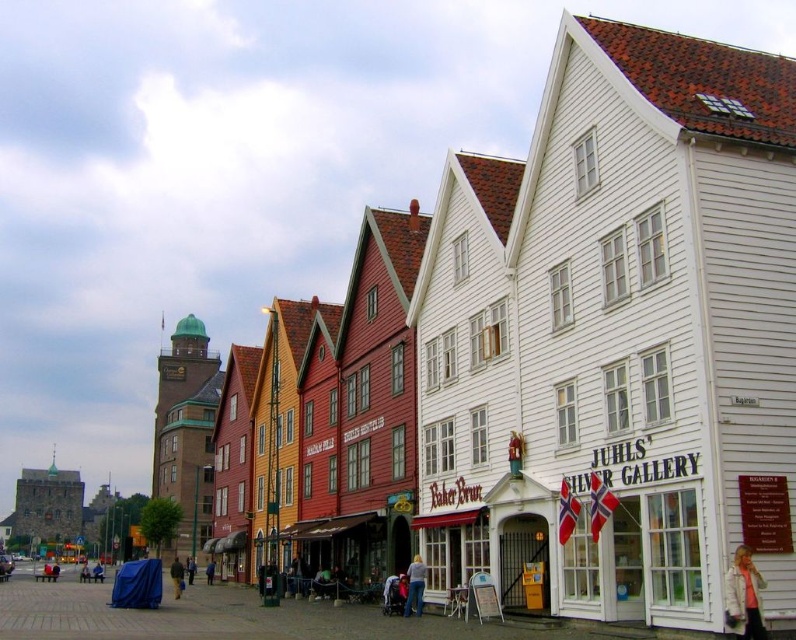
You are a tourist standing on the street in front of the Juhls Silver Gallery. You see a person wearing a white fabric jacket at lower right and light blue jeans at center. Which clothing item is located more to the right?

The white fabric jacket at lower right is more to the right than the light blue jeans at center.

You are a traveler visiting this Norwegian town and see a person wearing a white fabric jacket at lower right and light blue jeans at center. Which clothing item is wider?

The white fabric jacket at lower right is wider than the light blue jeans at center.